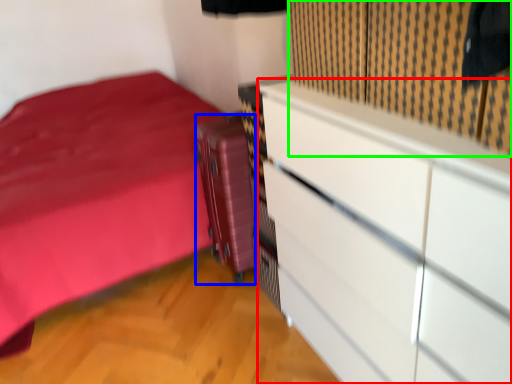
Question: Which is farther away from chest of drawers (highlighted by a red box)? luggage (highlighted by a blue box) or curtain (highlighted by a green box)?

Choices:
 (A) luggage
 (B) curtain

Answer: (A)